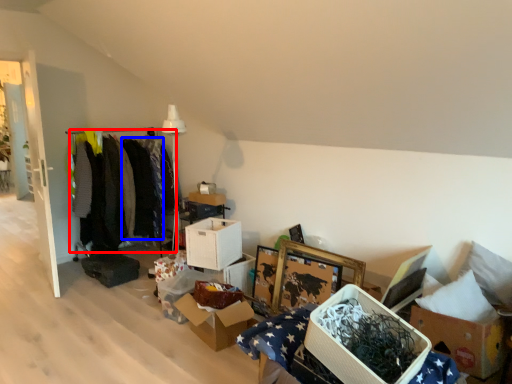
Question: Among these objects, which one is nearest to the camera, clothing (highlighted by a red box) or clothing (highlighted by a blue box)?

Choices:
 (A) clothing
 (B) clothing

Answer: (A)